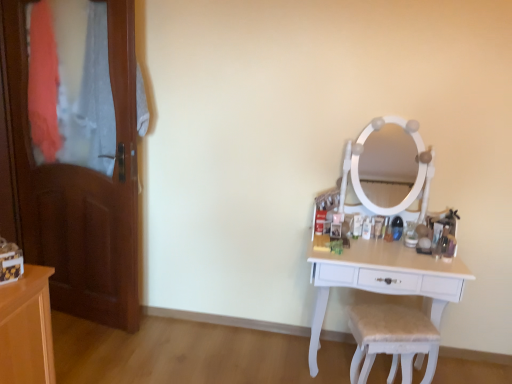
Question: Is wooden door at left positioned behind white fabric-covered chair at lower right?

Choices:
 (A) yes
 (B) no

Answer: (A)

Question: Is wooden door at left facing towards white fabric-covered chair at lower right?

Choices:
 (A) no
 (B) yes

Answer: (A)

Question: Are wooden door at left and white fabric-covered chair at lower right far apart?

Choices:
 (A) no
 (B) yes

Answer: (B)

Question: Is the surface of wooden door at left in direct contact with white fabric-covered chair at lower right?

Choices:
 (A) yes
 (B) no

Answer: (B)

Question: From the image's perspective, is wooden door at left under white fabric-covered chair at lower right?

Choices:
 (A) yes
 (B) no

Answer: (B)

Question: Can you confirm if wooden door at left is smaller than white fabric-covered chair at lower right?

Choices:
 (A) no
 (B) yes

Answer: (A)

Question: From the image's perspective, is white fabric-covered chair at lower right on top of wooden door at left?

Choices:
 (A) yes
 (B) no

Answer: (B)

Question: From a real-world perspective, is white fabric-covered chair at lower right positioned over wooden door at left based on gravity?

Choices:
 (A) yes
 (B) no

Answer: (B)

Question: Considering the relative sizes of white fabric-covered chair at lower right and wooden door at left in the image provided, is white fabric-covered chair at lower right thinner than wooden door at left?

Choices:
 (A) no
 (B) yes

Answer: (A)

Question: Is white fabric-covered chair at lower right far away from wooden door at left?

Choices:
 (A) no
 (B) yes

Answer: (B)

Question: Is wooden door at left at the back of white fabric-covered chair at lower right?

Choices:
 (A) yes
 (B) no

Answer: (B)

Question: Does white fabric-covered chair at lower right have a greater height compared to wooden door at left?

Choices:
 (A) yes
 (B) no

Answer: (B)

Question: From the image's perspective, is wooden door at left located beneath white wood table at right?

Choices:
 (A) yes
 (B) no

Answer: (B)